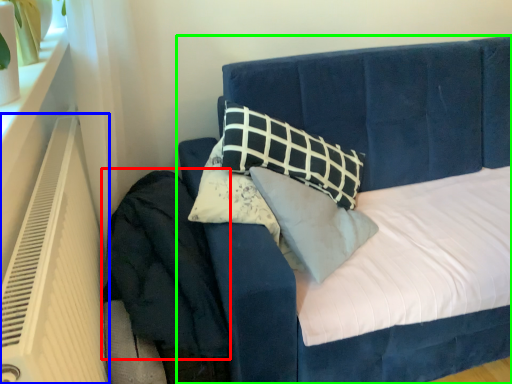
Question: Which object is the farthest from velvet (highlighted by a red box)? Choose among these: heater (highlighted by a blue box) or bed (highlighted by a green box).

Choices:
 (A) heater
 (B) bed

Answer: (B)